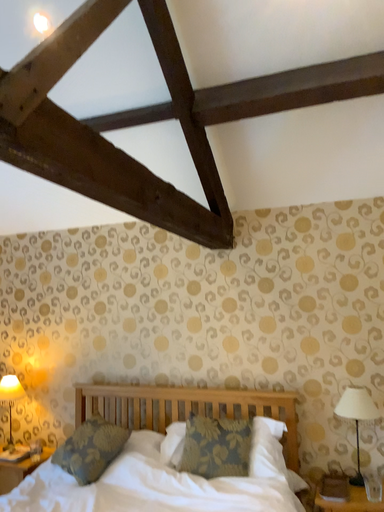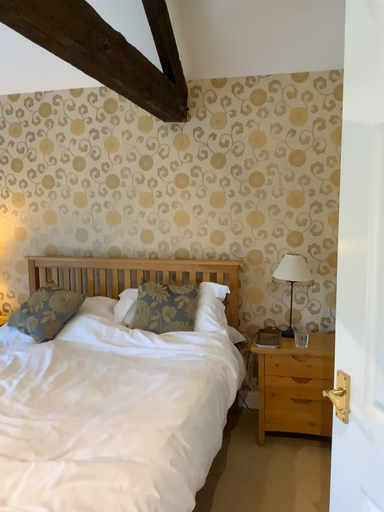
Question: How did the camera likely rotate when shooting the video?

Choices:
 (A) rotated downward
 (B) rotated upward

Answer: (A)